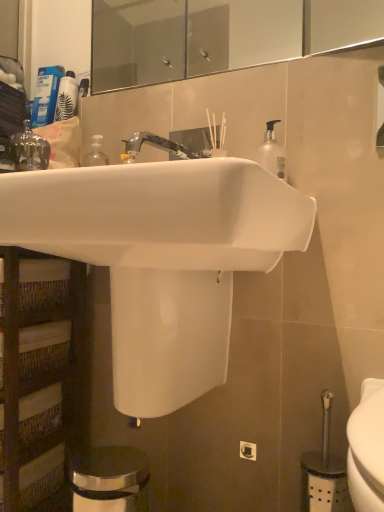
Question: Is white glossy sink at center bigger than compact blue lotion at upper left?

Choices:
 (A) no
 (B) yes

Answer: (B)

Question: From the image's perspective, is white glossy sink at center under compact blue lotion at upper left?

Choices:
 (A) yes
 (B) no

Answer: (A)

Question: Can you confirm if white glossy sink at center is positioned to the right of compact blue lotion at upper left?

Choices:
 (A) no
 (B) yes

Answer: (B)

Question: Is white glossy sink at center smaller than compact blue lotion at upper left?

Choices:
 (A) yes
 (B) no

Answer: (B)

Question: Is white glossy sink at center outside compact blue lotion at upper left?

Choices:
 (A) no
 (B) yes

Answer: (B)

Question: In the image, is compact blue lotion at upper left on the left side or the right side of gold metallic crown at upper left?

Choices:
 (A) left
 (B) right

Answer: (A)

Question: In terms of height, does compact blue lotion at upper left look taller or shorter compared to gold metallic crown at upper left?

Choices:
 (A) short
 (B) tall

Answer: (B)

Question: Considering the positions of point (52, 105) and point (14, 137), is point (52, 105) closer or farther from the camera than point (14, 137)?

Choices:
 (A) closer
 (B) farther

Answer: (B)

Question: From the image's perspective, is compact blue lotion at upper left positioned above or below gold metallic crown at upper left?

Choices:
 (A) below
 (B) above

Answer: (B)

Question: Considering the positions of gold metallic crown at upper left and compact blue lotion at upper left in the image, is gold metallic crown at upper left bigger or smaller than compact blue lotion at upper left?

Choices:
 (A) big
 (B) small

Answer: (B)

Question: Considering the positions of gold metallic crown at upper left and compact blue lotion at upper left in the image, is gold metallic crown at upper left taller or shorter than compact blue lotion at upper left?

Choices:
 (A) tall
 (B) short

Answer: (B)

Question: Considering the positions of point (18, 162) and point (57, 72), is point (18, 162) closer or farther from the camera than point (57, 72)?

Choices:
 (A) farther
 (B) closer

Answer: (B)

Question: From a real-world perspective, is gold metallic crown at upper left positioned above or below compact blue lotion at upper left?

Choices:
 (A) above
 (B) below

Answer: (B)

Question: From a real-world perspective, is woven wood shelf at left above or below white glossy sink at center?

Choices:
 (A) above
 (B) below

Answer: (B)

Question: Based on their sizes in the image, would you say woven wood shelf at left is bigger or smaller than white glossy sink at center?

Choices:
 (A) big
 (B) small

Answer: (B)